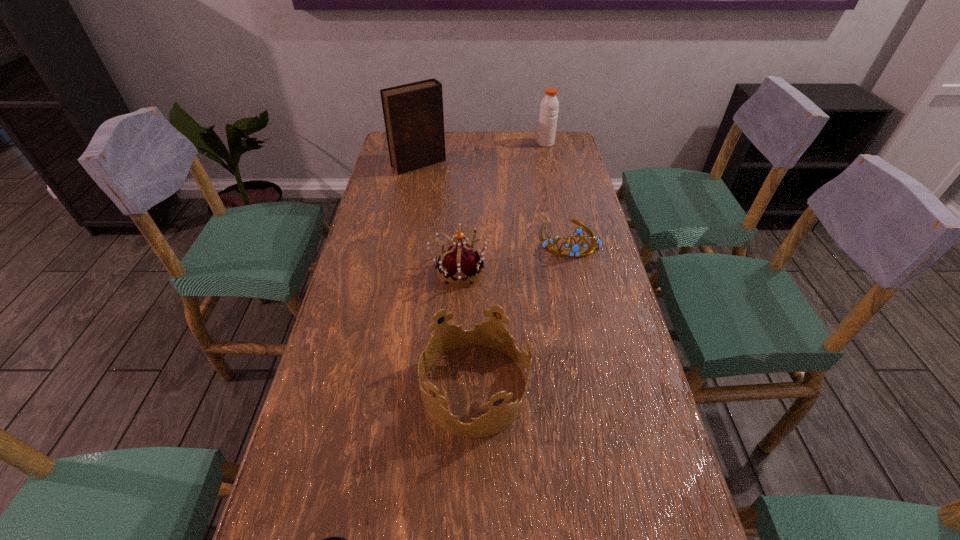
Identify the location of vacant region at the right edge of the desktop. The width and height of the screenshot is (960, 540). (630, 525).

Locate an element on the screen. The width and height of the screenshot is (960, 540). vacant space at the far right corner of the desktop is located at coordinates (556, 159).

Where is `free space between the Bible and the rightmost tiara`? This screenshot has height=540, width=960. free space between the Bible and the rightmost tiara is located at coordinates (494, 201).

Select which object appears as the fifth closest to the Bible. Please provide its 2D coordinates. Your answer should be formatted as a tuple, i.e. [(x, y)], where the tuple contains the x and y coordinates of a point satisfying the conditions above.

[(334, 539)]

You are a GUI agent. You are given a task and a screenshot of the screen. Output one action in this format:
    pyautogui.click(x=<x>, y=<y>)
    Task: Click on the object that is the fifth closest to the shaker
    This screenshot has width=960, height=540.
    Given the screenshot: What is the action you would take?
    pyautogui.click(x=334, y=539)

Locate which tiara is the closest to the fifth farthest object. Please provide its 2D coordinates. Your answer should be formatted as a tuple, i.e. [(x, y)], where the tuple contains the x and y coordinates of a point satisfying the conditions above.

[(460, 262)]

Select which tiara is the second closest to the shortest tiara. Please provide its 2D coordinates. Your answer should be formatted as a tuple, i.e. [(x, y)], where the tuple contains the x and y coordinates of a point satisfying the conditions above.

[(492, 333)]

Locate an element on the screen. blank area in the image that satisfies the following two spatial constraints: 1. on the front-facing side of the shortest tiara; 2. on the front-facing side of the fifth farthest object is located at coordinates (603, 387).